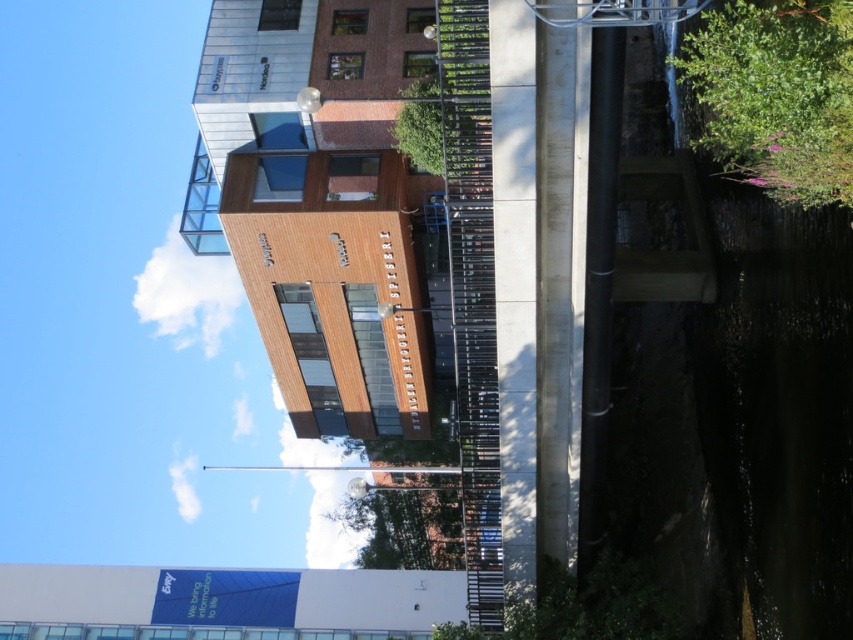
You are standing on the bridge and looking at the building. There is a point at coordinates point (229, 600). Where is this point located?

The point (229, 600) is on the white glossy signboard at lower center.

You are standing on the bridge and want to read the white glossy signboard at lower center and the green leafy bush at upper right. Which object is closer to you?

The white glossy signboard at lower center is closer to you because it is further to the viewer than the green leafy bush at upper right.

You are standing at the entrance of the building and looking towards the waterway. There is a point marked at coordinates (776,93). What object is located at this point?

The point at coordinates (776,93) corresponds to a green leafy bush at upper right.